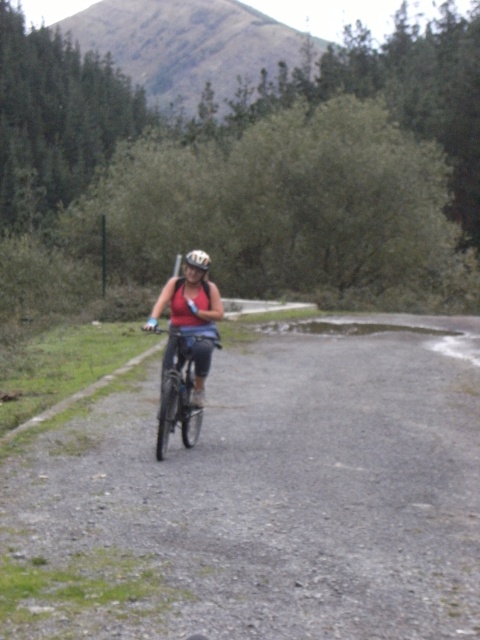
You are a delivery person who needs to place the shiny metallic bicycle at center onto the gravel road at center. Based on the scene, will the bicycle be higher or lower than the road after placing it?

The gravel road at center has a lesser height compared to the shiny metallic bicycle at center, so when placed on the road, the bicycle will be higher than the road.

From the picture: You are a delivery person who needs to carry a package that is 1.2 meters wide. You see the shiny metallic bicycle at center and the matte black helmet at center. Which item can you use to carry the package, considering their widths?

The shiny metallic bicycle at center has a width less than the matte black helmet at center, so the matte black helmet at center is wider and can be used to carry the package.